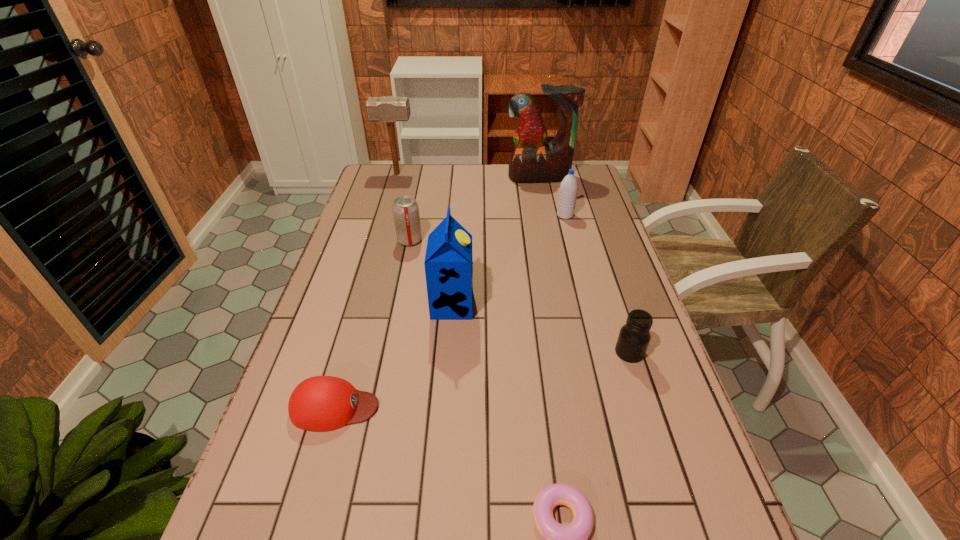
The image size is (960, 540). I want to click on vacant region at the right edge, so click(663, 427).

Where is `vacant space at the far right corner of the desktop`? vacant space at the far right corner of the desktop is located at coordinates (588, 182).

You are a GUI agent. You are given a task and a screenshot of the screen. Output one action in this format:
    pyautogui.click(x=<x>, y=<y>)
    Task: Click on the free space between the jar and the fourth tallest object
    
    Given the screenshot: What is the action you would take?
    pyautogui.click(x=597, y=284)

You are a GUI agent. You are given a task and a screenshot of the screen. Output one action in this format:
    pyautogui.click(x=<x>, y=<y>)
    Task: Click on the unoccupied area between the fourth farthest object and the parrot
    This screenshot has height=540, width=960.
    Given the screenshot: What is the action you would take?
    pyautogui.click(x=474, y=209)

Where is `free space between the water bottle and the fourth object from left to right`? The image size is (960, 540). free space between the water bottle and the fourth object from left to right is located at coordinates (509, 260).

Locate an element on the screen. This screenshot has height=540, width=960. free space between the fifth shortest object and the carton is located at coordinates (509, 260).

Image resolution: width=960 pixels, height=540 pixels. Identify the location of vacant region between the jar and the fifth tallest object. (519, 296).

In order to click on vacant space that's between the jar and the fifth object from right to left in this screenshot , I will do `click(540, 328)`.

At what (x,y) coordinates should I click in order to perform the action: click on vacant space that's between the third nearest object and the mallet. Please return your answer as a coordinate pair (x, y). The image size is (960, 540). Looking at the image, I should click on (514, 263).

Find the location of a particular element. This screenshot has height=540, width=960. unoccupied position between the baseball cap and the fifth object from right to left is located at coordinates (394, 356).